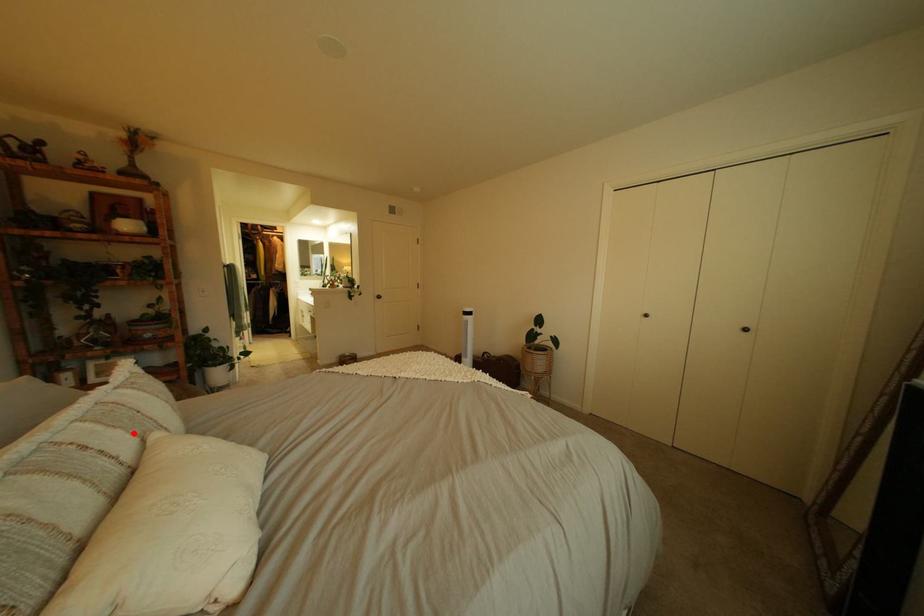
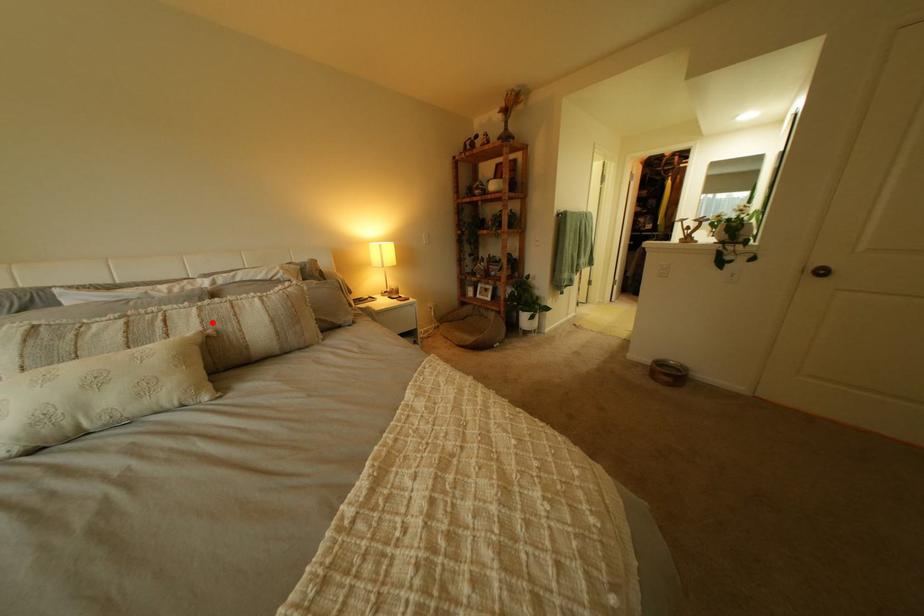
I am providing you with two images of the same scene from different viewpoints. A red point is marked on the first image and another point is marked on the second image. Does the point marked in image1 correspond to the same location as the one in image2?

Yes